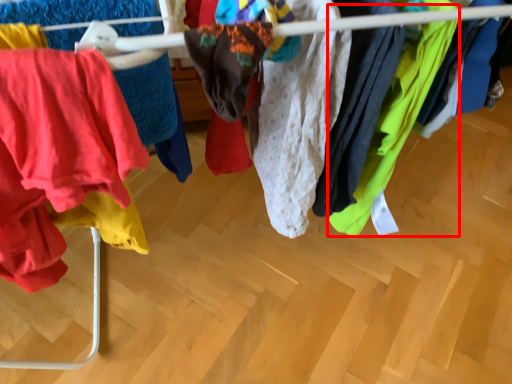
Question: In this image, where is clothing (annotated by the red box) located relative to clothing?

Choices:
 (A) left
 (B) right

Answer: (B)